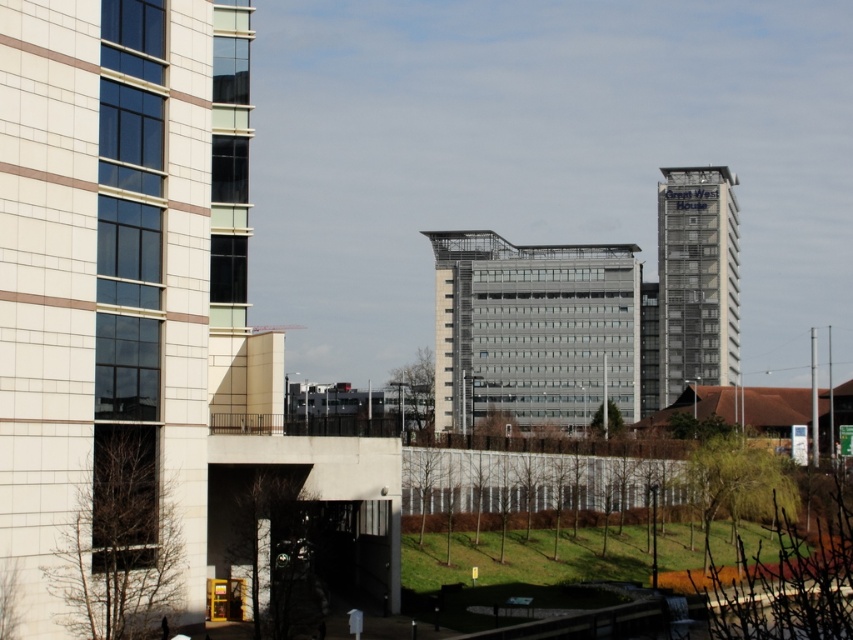
Is metallic glass building at center smaller than glassy silver tower at upper right?

No.

Does point (606, 259) come farther from viewer compared to point (706, 294)?

Yes.

At what (x,y) coordinates should I click in order to perform the action: click on metallic glass building at center. Please return your answer as a coordinate pair (x, y). This screenshot has width=853, height=640. Looking at the image, I should click on (532, 330).

Between metallic glass building at center and concrete entrance at center, which one appears on the right side from the viewer's perspective?

Positioned to the right is metallic glass building at center.

Does metallic glass building at center appear on the right side of concrete entrance at center?

Correct, you'll find metallic glass building at center to the right of concrete entrance at center.

Is point (608, 330) closer to viewer compared to point (392, 524)?

No, (608, 330) is further to viewer.

At what (x,y) coordinates should I click in order to perform the action: click on metallic glass building at center. Please return your answer as a coordinate pair (x, y). The height and width of the screenshot is (640, 853). Looking at the image, I should click on (532, 330).

Does concrete entrance at center have a larger size compared to glassy silver tower at upper right?

Actually, concrete entrance at center might be smaller than glassy silver tower at upper right.

Is concrete entrance at center above glassy silver tower at upper right?

Incorrect, concrete entrance at center is not positioned above glassy silver tower at upper right.

This screenshot has width=853, height=640. I want to click on concrete entrance at center, so click(317, 500).